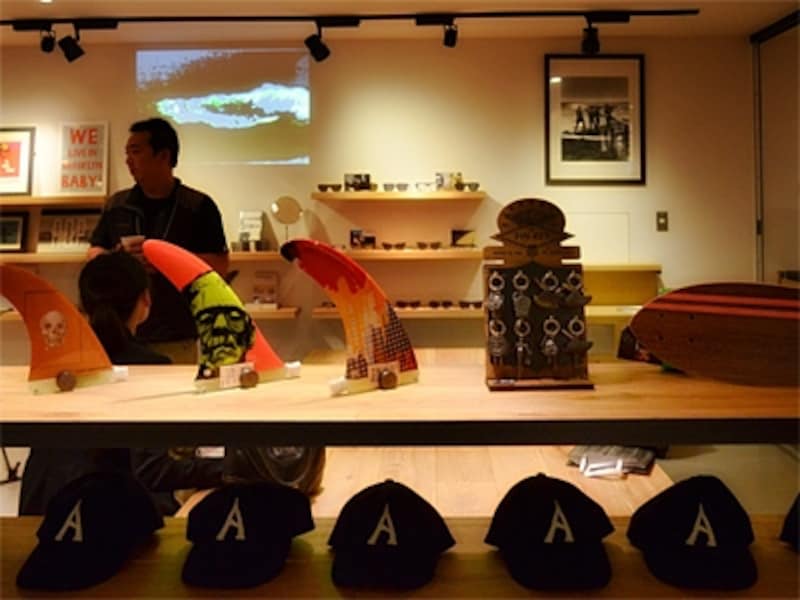
At what (x,y) coordinates should I click in order to perform the action: click on table. Please return your answer as a coordinate pair (x, y). Looking at the image, I should click on point(632,429).